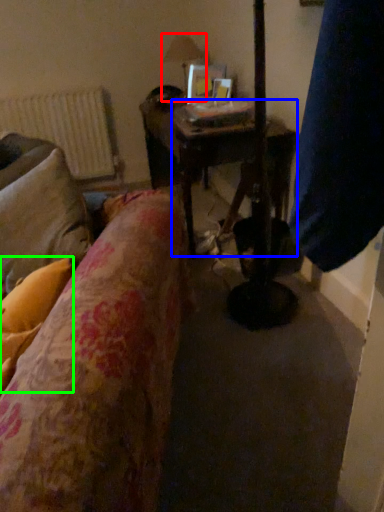
Question: Considering the real-world distances, which object is farthest from table lamp (highlighted by a red box)? table (highlighted by a blue box) or pillow (highlighted by a green box)?

Choices:
 (A) table
 (B) pillow

Answer: (B)